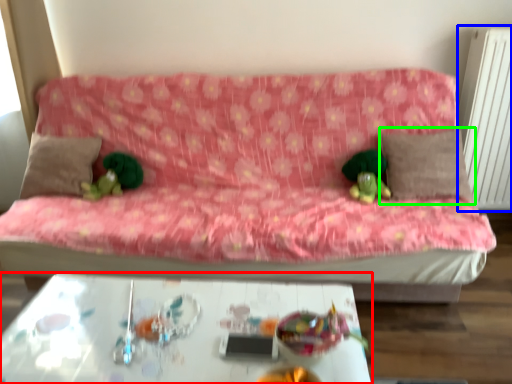
Question: Estimate the real-world distances between objects in this image. Which object is closer to table (highlighted by a red box), radiator (highlighted by a blue box) or pillow (highlighted by a green box)?

Choices:
 (A) radiator
 (B) pillow

Answer: (B)